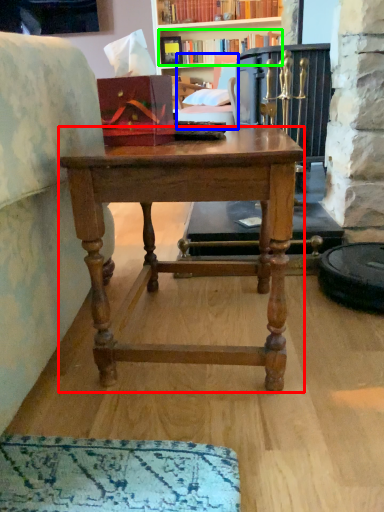
Question: Which object is positioned closest to desk (highlighted by a red box)? Select from swivel chair (highlighted by a blue box) and book (highlighted by a green box).

Choices:
 (A) swivel chair
 (B) book

Answer: (A)